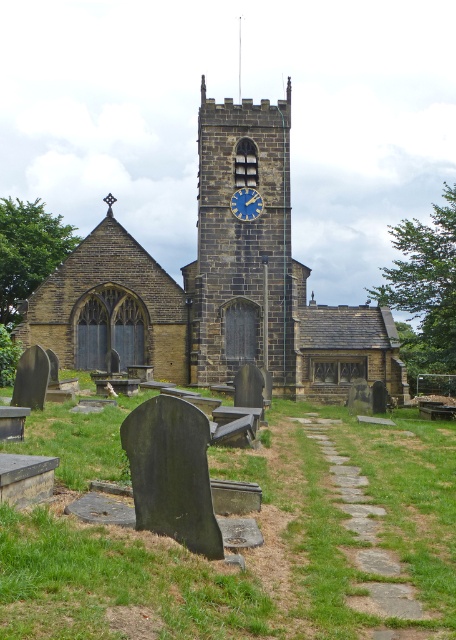
Question: Which object is farther from the camera taking this photo?

Choices:
 (A) brown stone church at center
 (B) blue painted clock face at center
 (C) stone clock tower at center

Answer: (B)

Question: Which object is positioned farthest from the blue painted clock face at center?

Choices:
 (A) stone clock tower at center
 (B) brown stone church at center

Answer: (B)

Question: Does brown stone church at center appear on the left side of blue painted clock face at center?

Choices:
 (A) yes
 (B) no

Answer: (A)

Question: Which of these objects is positioned closest to the blue painted clock face at center?

Choices:
 (A) brown stone church at center
 (B) stone clock tower at center

Answer: (B)

Question: Can you confirm if brown stone church at center is positioned above stone clock tower at center?

Choices:
 (A) no
 (B) yes

Answer: (A)

Question: Does stone clock tower at center appear on the left side of blue painted clock face at center?

Choices:
 (A) yes
 (B) no

Answer: (B)